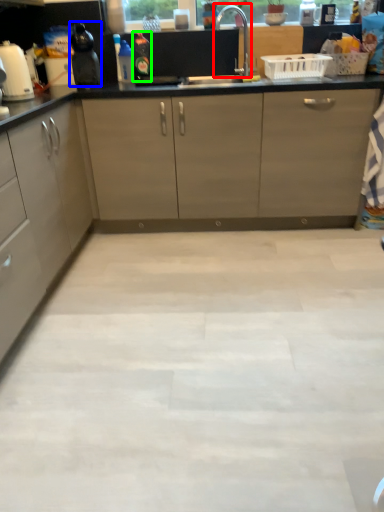
Question: Estimate the real-world distances between objects in this image. Which object is farther from faucet (highlighted by a red box), kitchen appliance (highlighted by a blue box) or bottle (highlighted by a green box)?

Choices:
 (A) kitchen appliance
 (B) bottle

Answer: (A)